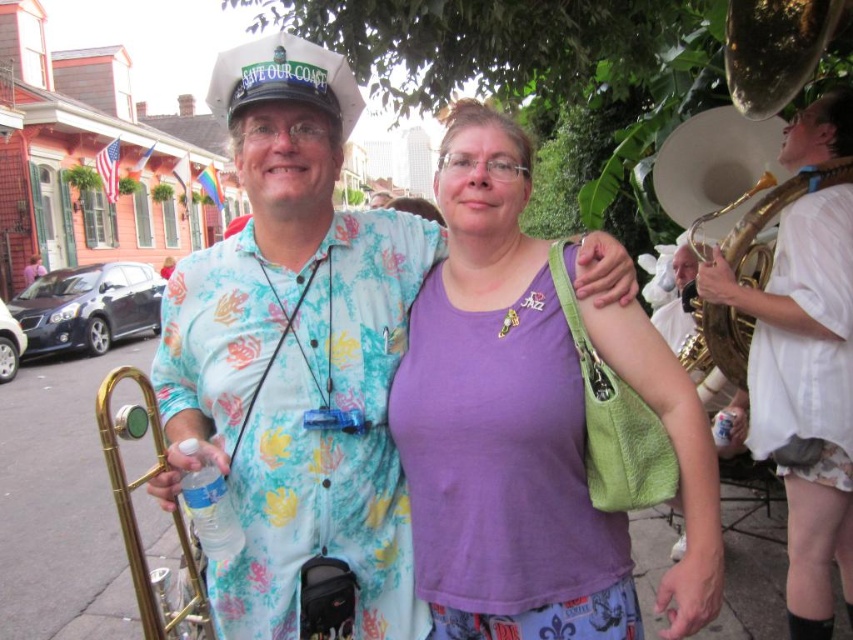
You are a photographer trying to capture a clear shot of both the white glossy saxophone at right and the gold brass trumpet at right. Since both are in the same area, which one should you focus on first to ensure it appears sharp in your photo?

The white glossy saxophone at right is closer to the viewer than the gold brass trumpet at right, so you should focus on the white glossy saxophone at right first to ensure it appears sharp in your photo.

You are a photographer trying to capture a closeup shot of the brass trombone held by the person on the left. You have two focus points available at coordinates point (459, 424) and point (700, 355). Which focus point should you use to ensure the trombone is in focus?

Point (459, 424) is closer to the camera than point (700, 355), so you should use point (459, 424) to ensure the trombone is in focus.

You are standing at the point labeled as point (842, 141) in the image. You want to take a photo of the person on the right who is wearing a purple tank top and patterned shorts. Can you directly see them from your current position?

The point (842, 141) is 22.29 feet away from the viewer. Since the person on the right is in the foreground, they are likely within this distance, so yes, you can directly see them from your current position.